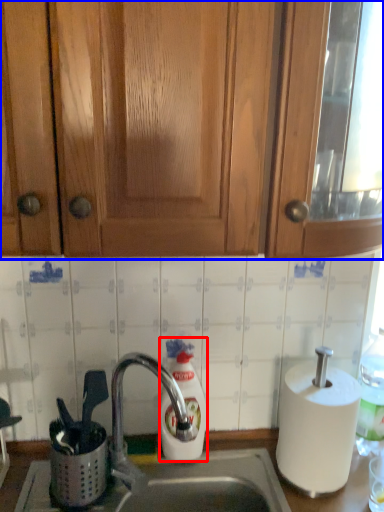
Question: Which object appears farthest to the camera in this image, soap dispenser (highlighted by a red box) or cabinetry (highlighted by a blue box)?

Choices:
 (A) soap dispenser
 (B) cabinetry

Answer: (A)